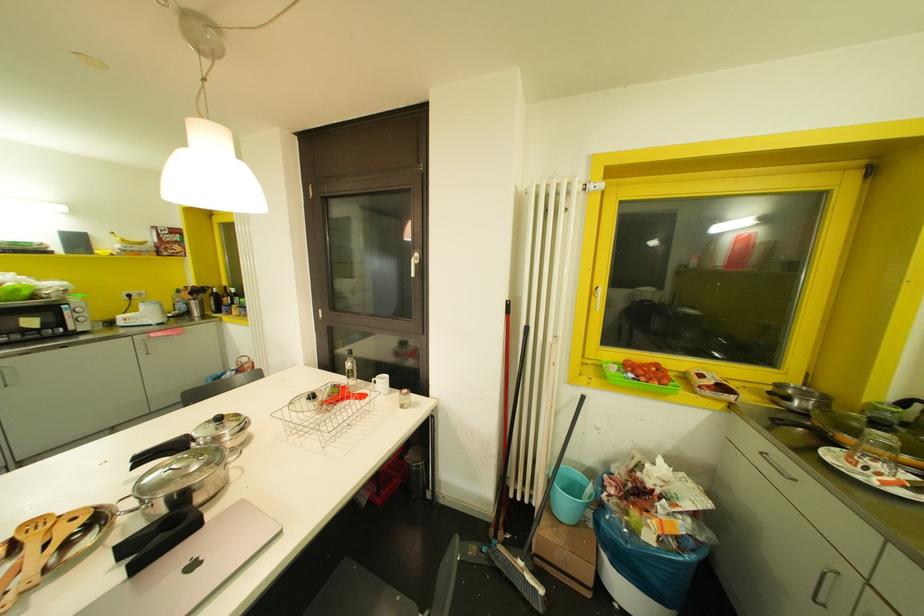
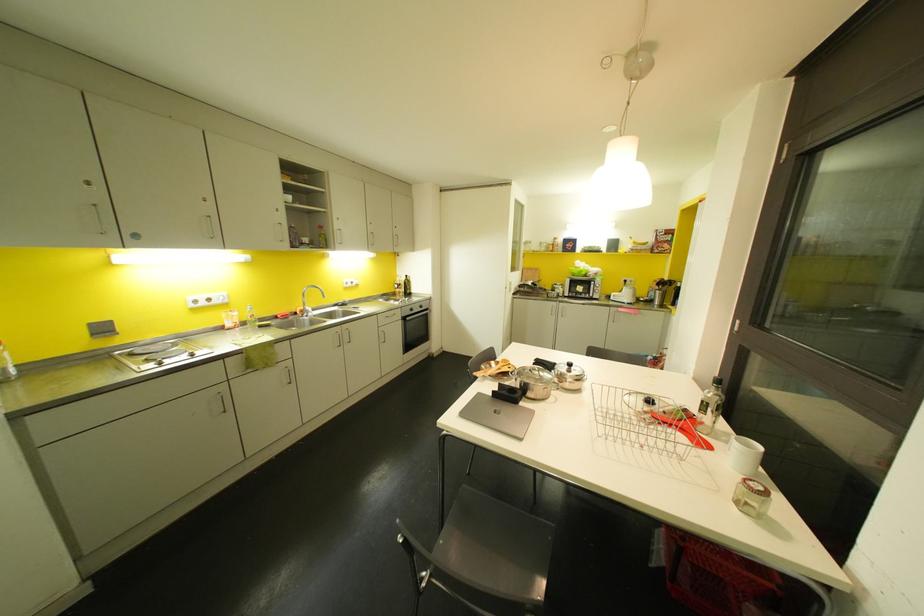
Question: The camera is either moving clockwise (left) or counter-clockwise (right) around the object. The first image is from the beginning of the video and the second image is from the end. Is the camera moving left or right when shooting the video?

Choices:
 (A) Left
 (B) Right

Answer: (B)